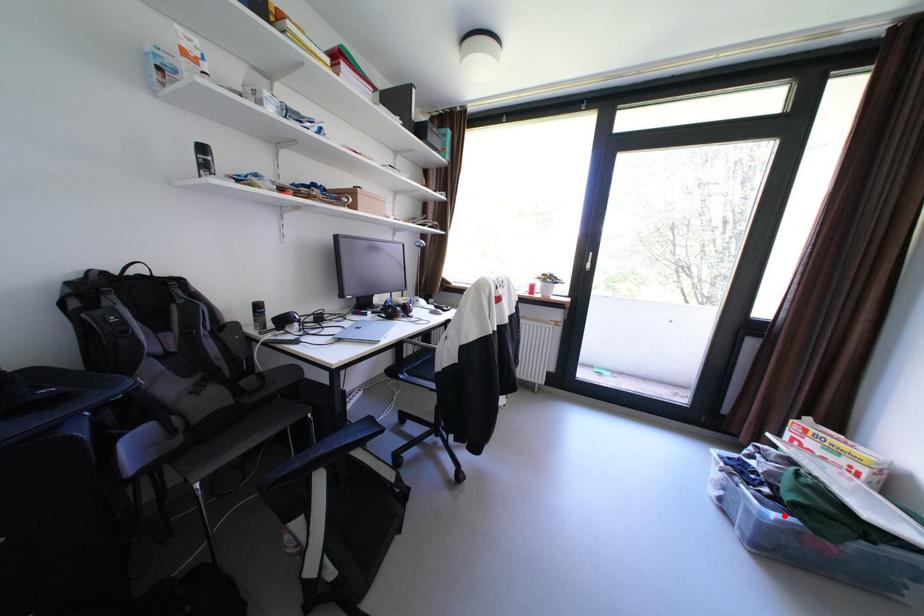
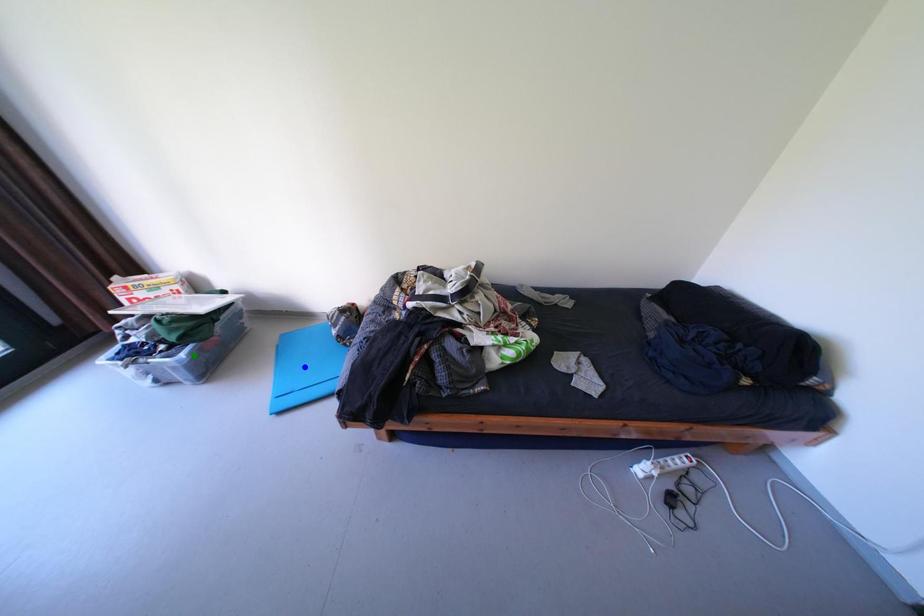
Question: I am providing you with two images of the same scene from different viewpoints. A red point is marked on the first image. You are given multiple points on the second image. Which point in image 2 is actually the same real-world point as the red point in image 1?

Choices:
 (A) yellow point
 (B) green point
 (C) blue point

Answer: (B)